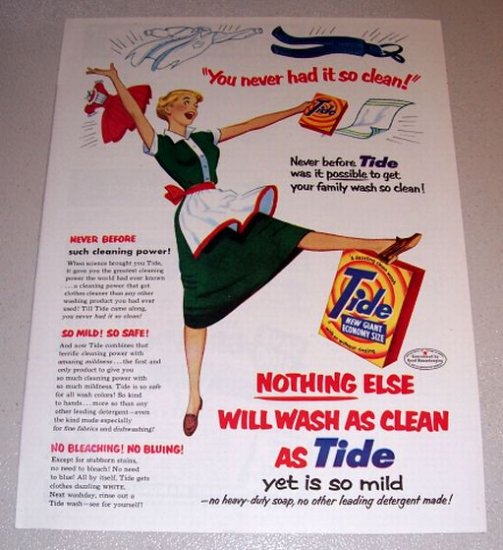
I want to click on 11x17 white poster, so click(26, 499).